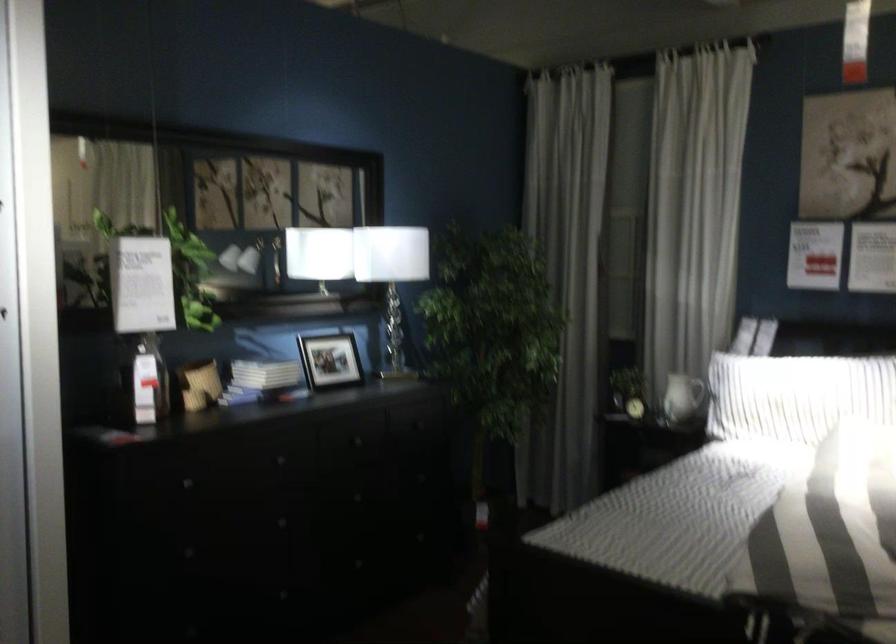
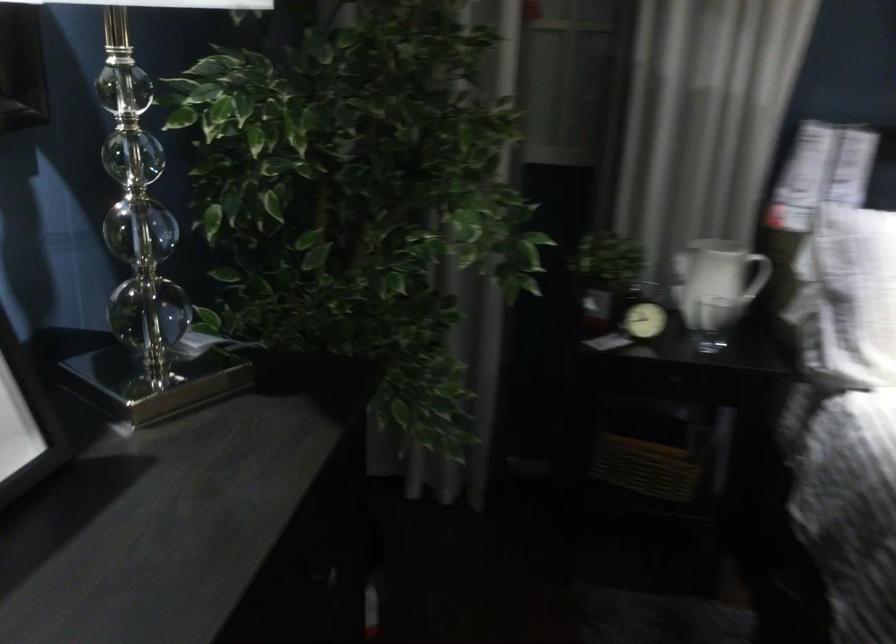
Find the pixel in the second image that matches the point at 704,382 in the first image.

(765, 276)